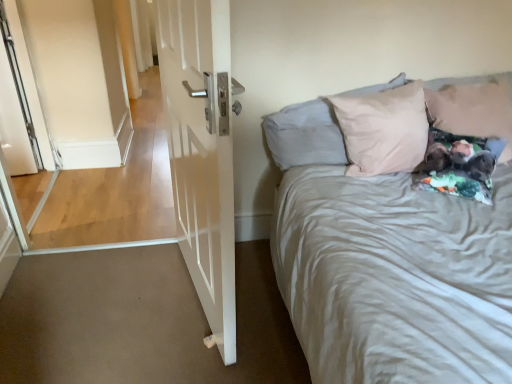
Question: Can you confirm if white glossy door at left is thinner than light pink fabric pillow at upper right, the second pillow in the right-to-left sequence?

Choices:
 (A) no
 (B) yes

Answer: (B)

Question: Does white glossy door at left appear on the right side of light pink fabric pillow at upper right, the second pillow in the right-to-left sequence?

Choices:
 (A) yes
 (B) no

Answer: (B)

Question: Does white glossy door at left have a greater height compared to light pink fabric pillow at upper right, the second pillow in the right-to-left sequence?

Choices:
 (A) no
 (B) yes

Answer: (B)

Question: Considering the relative sizes of white glossy door at left and light pink fabric pillow at upper right, arranged as the 1th pillow when viewed from the left, in the image provided, is white glossy door at left shorter than light pink fabric pillow at upper right, arranged as the 1th pillow when viewed from the left,?

Choices:
 (A) no
 (B) yes

Answer: (A)

Question: Are white glossy door at left and light pink fabric pillow at upper right, the second pillow in the right-to-left sequence, beside each other?

Choices:
 (A) no
 (B) yes

Answer: (A)

Question: Can you confirm if white glossy door at left is wider than light pink fabric pillow at upper right, the second pillow in the right-to-left sequence?

Choices:
 (A) no
 (B) yes

Answer: (A)

Question: Is light pink fabric pillow at upper right, which is the 1th pillow in right-to-left order, far away from white glossy door at left?

Choices:
 (A) yes
 (B) no

Answer: (A)

Question: Considering the relative sizes of light pink fabric pillow at upper right, which is the second pillow in left-to-right order, and white glossy door at left in the image provided, is light pink fabric pillow at upper right, which is the second pillow in left-to-right order, thinner than white glossy door at left?

Choices:
 (A) no
 (B) yes

Answer: (A)

Question: From a real-world perspective, does light pink fabric pillow at upper right, which is the 1th pillow in right-to-left order, sit lower than white glossy door at left?

Choices:
 (A) yes
 (B) no

Answer: (B)

Question: Is light pink fabric pillow at upper right, which is the 1th pillow in right-to-left order, wider than white glossy door at left?

Choices:
 (A) no
 (B) yes

Answer: (B)

Question: From the image's perspective, is light pink fabric pillow at upper right, which is the 1th pillow in right-to-left order, on top of white glossy door at left?

Choices:
 (A) no
 (B) yes

Answer: (B)

Question: Is light pink fabric pillow at upper right, which is the 1th pillow in right-to-left order, bigger than white glossy door at left?

Choices:
 (A) no
 (B) yes

Answer: (A)

Question: Does white glossy door at left lie behind light pink fabric pillow at upper right, which is the 1th pillow in right-to-left order?

Choices:
 (A) yes
 (B) no

Answer: (B)